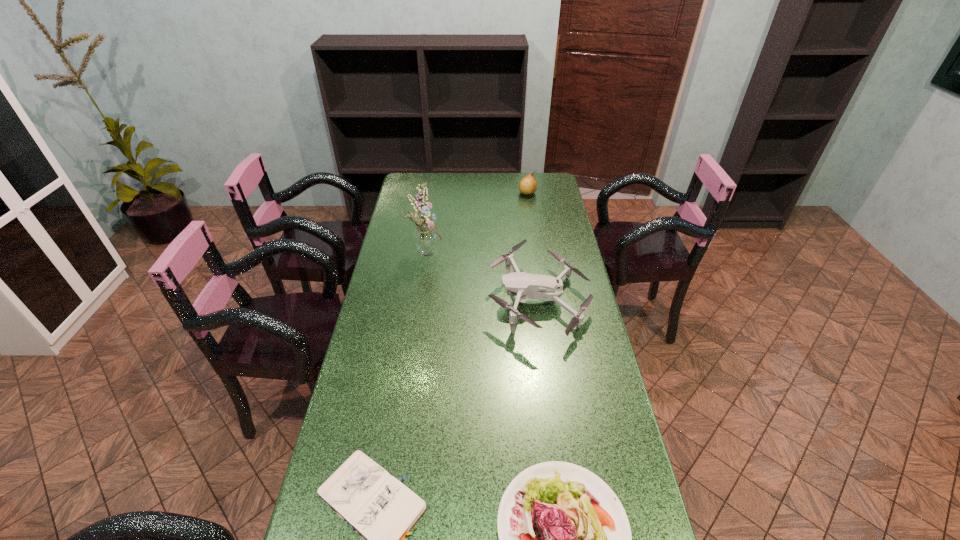
What are the coordinates of `pear present at the right edge` in the screenshot? It's located at (528, 185).

Identify the location of drone that is at the right edge. The height and width of the screenshot is (540, 960). (525, 286).

This screenshot has height=540, width=960. What are the coordinates of `object that is positioned at the far right corner` in the screenshot? It's located at (528, 185).

Locate an element on the screen. The image size is (960, 540). blank space at the far edge is located at coordinates (463, 192).

Locate an element on the screen. This screenshot has height=540, width=960. free region at the left edge of the desktop is located at coordinates (410, 310).

Where is `blank space at the right edge of the desktop`? The height and width of the screenshot is (540, 960). blank space at the right edge of the desktop is located at coordinates (558, 246).

The height and width of the screenshot is (540, 960). In the image, there is a desktop. Identify the location of vacant space at the far left corner. (429, 179).

The image size is (960, 540). In the image, there is a desktop. What are the coordinates of `blank space at the far right corner` in the screenshot? It's located at (546, 178).

Where is `free spot between the farthest object and the drone`? This screenshot has height=540, width=960. free spot between the farthest object and the drone is located at coordinates (533, 247).

Locate an element on the screen. The width and height of the screenshot is (960, 540). empty space between the tallest object and the drone is located at coordinates (483, 276).